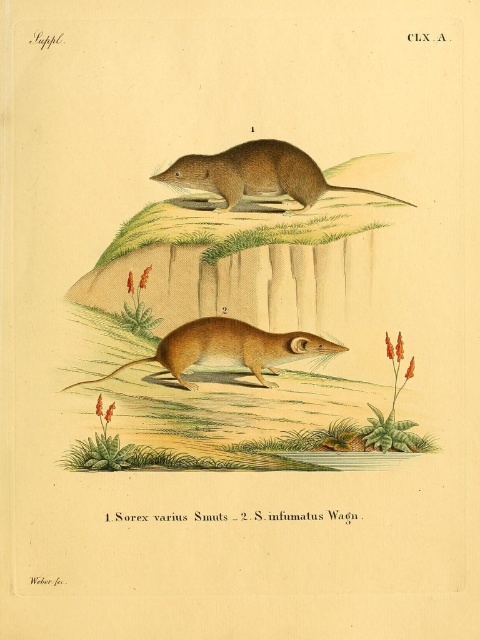
You are an animal researcher observing the illustration. You notice two mice labeled as brown fur mouse at center and brown furry mouse at upper center. Which mouse is located higher in the image?

The brown furry mouse at upper center is positioned higher in the image than the brown fur mouse at center.